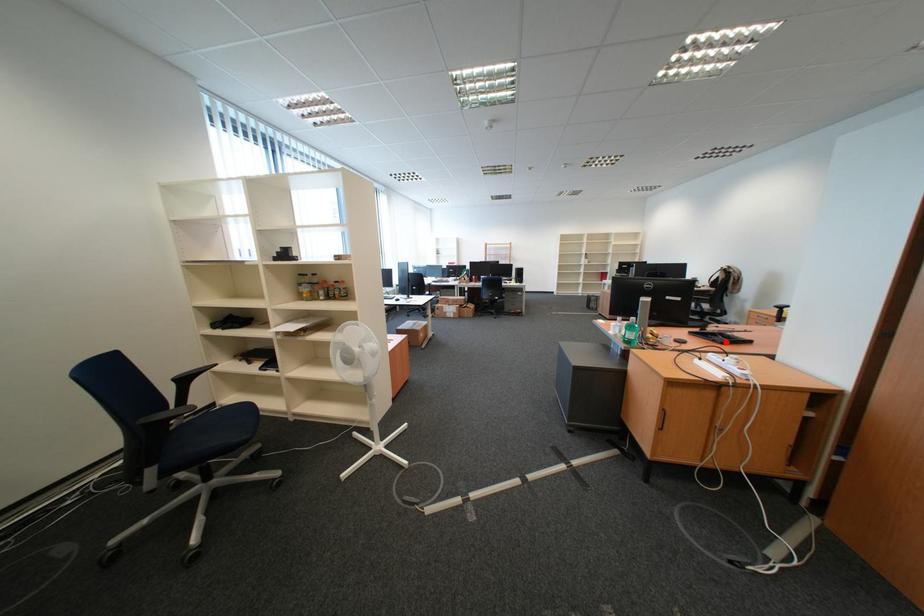
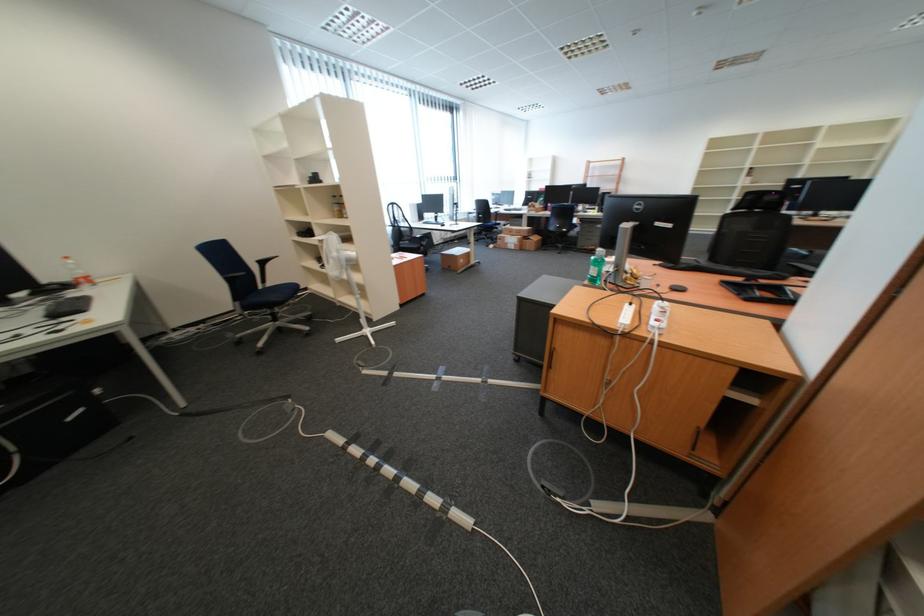
Find the pixel in the second image that matches the highlighted location in the first image.

(749, 296)